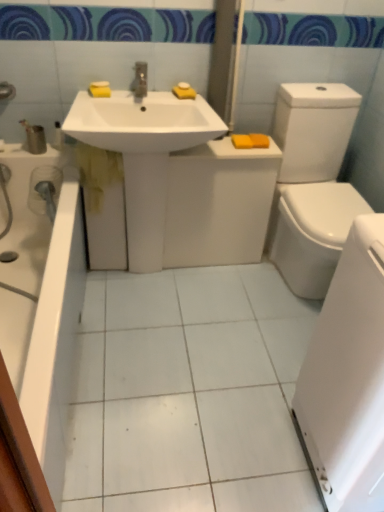
Question: Are yellow sponge at upper center, which is the third soap from right to left, and white glossy bathtub at lower left located far from each other?

Choices:
 (A) yes
 (B) no

Answer: (A)

Question: From a real-world perspective, is yellow sponge at upper center, arranged as the third soap when viewed from the left, beneath white glossy bathtub at lower left?

Choices:
 (A) no
 (B) yes

Answer: (A)

Question: Are yellow sponge at upper center, arranged as the third soap when viewed from the left, and white glossy bathtub at lower left making contact?

Choices:
 (A) no
 (B) yes

Answer: (A)

Question: Considering the relative sizes of yellow sponge at upper center, arranged as the third soap when viewed from the left, and white glossy bathtub at lower left in the image provided, is yellow sponge at upper center, arranged as the third soap when viewed from the left, thinner than white glossy bathtub at lower left?

Choices:
 (A) no
 (B) yes

Answer: (B)

Question: Does yellow sponge at upper center, arranged as the third soap when viewed from the left, have a lesser height compared to white glossy bathtub at lower left?

Choices:
 (A) no
 (B) yes

Answer: (B)

Question: Is yellow matte soap at right, marked as the first soap in a right-to-left arrangement, bigger or smaller than white glossy sink at center?

Choices:
 (A) big
 (B) small

Answer: (B)

Question: From a real-world perspective, is yellow matte soap at right, marked as the first soap in a right-to-left arrangement, positioned above or below white glossy sink at center?

Choices:
 (A) below
 (B) above

Answer: (A)

Question: Choose the correct answer: Is yellow matte soap at right, marked as the first soap in a right-to-left arrangement, inside white glossy sink at center or outside it?

Choices:
 (A) outside
 (B) inside

Answer: (A)

Question: From the image's perspective, is yellow matte soap at right, marked as the first soap in a right-to-left arrangement, positioned above or below white glossy sink at center?

Choices:
 (A) above
 (B) below

Answer: (B)

Question: Does point (241, 142) appear closer or farther from the camera than point (372, 471)?

Choices:
 (A) farther
 (B) closer

Answer: (A)

Question: Considering the positions of orange matte bar of soap at upper right, marked as the second soap in a right-to-left arrangement, and white glossy towel at lower right in the image, is orange matte bar of soap at upper right, marked as the second soap in a right-to-left arrangement, taller or shorter than white glossy towel at lower right?

Choices:
 (A) tall
 (B) short

Answer: (B)

Question: Which is correct: orange matte bar of soap at upper right, which is the 4th soap in left-to-right order, is inside white glossy towel at lower right, or outside of it?

Choices:
 (A) inside
 (B) outside

Answer: (B)

Question: Is orange matte bar of soap at upper right, marked as the second soap in a right-to-left arrangement, bigger or smaller than white glossy towel at lower right?

Choices:
 (A) small
 (B) big

Answer: (A)

Question: Is yellow sponge at upper center, which is the third soap from right to left, bigger or smaller than orange matte bar of soap at upper right, which is the 4th soap in left-to-right order?

Choices:
 (A) small
 (B) big

Answer: (A)

Question: Looking at their shapes, would you say yellow sponge at upper center, which is the third soap from right to left, is wider or thinner than orange matte bar of soap at upper right, which is the 4th soap in left-to-right order?

Choices:
 (A) wide
 (B) thin

Answer: (B)